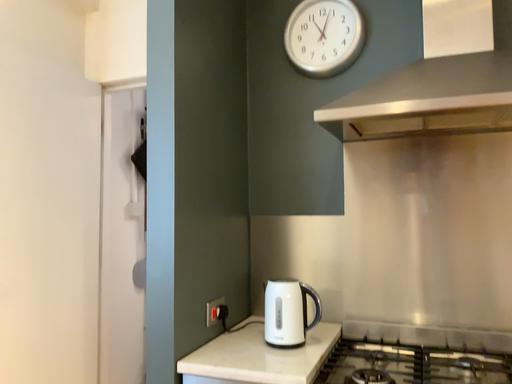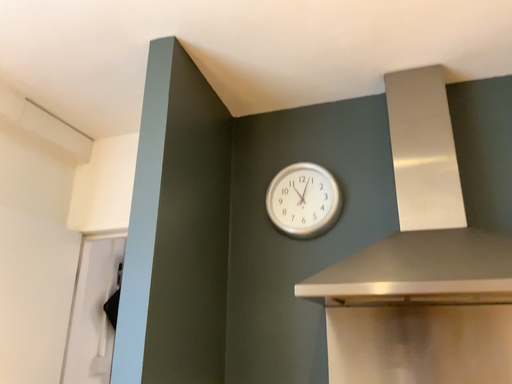
Question: Which way did the camera rotate in the video?

Choices:
 (A) rotated downward
 (B) rotated upward

Answer: (B)